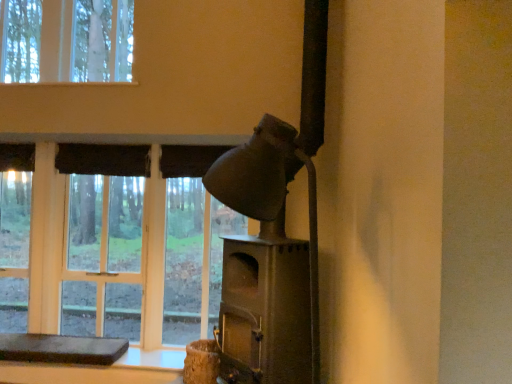
Question: Considering the relative sizes of matte gray fireplace at center-right and matte glass window at center in the image provided, is matte gray fireplace at center-right wider than matte glass window at center?

Choices:
 (A) no
 (B) yes

Answer: (B)

Question: From a real-world perspective, is matte gray fireplace at center-right under matte glass window at center?

Choices:
 (A) no
 (B) yes

Answer: (A)

Question: Is matte gray fireplace at center-right looking in the opposite direction of matte glass window at center?

Choices:
 (A) yes
 (B) no

Answer: (B)

Question: Considering the relative sizes of matte gray fireplace at center-right and matte glass window at center in the image provided, is matte gray fireplace at center-right shorter than matte glass window at center?

Choices:
 (A) no
 (B) yes

Answer: (A)

Question: Is matte gray fireplace at center-right aimed at matte glass window at center?

Choices:
 (A) yes
 (B) no

Answer: (B)

Question: Considering the relative positions of matte gray fireplace at center-right and matte glass window at center in the image provided, is matte gray fireplace at center-right to the right of matte glass window at center from the viewer's perspective?

Choices:
 (A) no
 (B) yes

Answer: (B)

Question: Is matte glass window at center positioned with its back to matte gray fireplace at center-right?

Choices:
 (A) yes
 (B) no

Answer: (B)

Question: Could matte gray fireplace at center-right be considered to be inside matte glass window at center?

Choices:
 (A) no
 (B) yes

Answer: (A)

Question: Does matte glass window at center have a lesser width compared to matte gray fireplace at center-right?

Choices:
 (A) yes
 (B) no

Answer: (A)

Question: Is matte glass window at center taller than matte gray fireplace at center-right?

Choices:
 (A) no
 (B) yes

Answer: (A)

Question: Can you see matte glass window at center touching matte gray fireplace at center-right?

Choices:
 (A) no
 (B) yes

Answer: (A)

Question: Is matte glass window at center behind matte gray fireplace at center-right?

Choices:
 (A) yes
 (B) no

Answer: (A)

Question: From the image's perspective, is brown leather cushion at lower left on matte glass window at center?

Choices:
 (A) no
 (B) yes

Answer: (A)